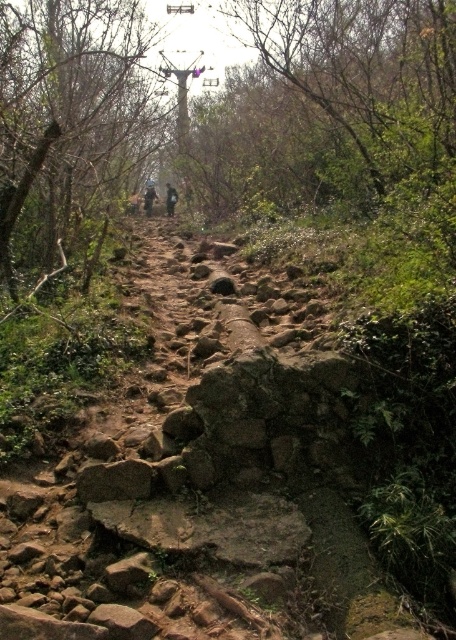
Does point (145, 195) come farther from viewer compared to point (165, 204)?

No, it is not.

Is dark gray fabric jacket at center positioned before dark brown leather backpack at center?

No, it is not.

Measure the distance between point (154, 188) and camera.

The distance of point (154, 188) from camera is 76.91 feet.

Where is `dark gray fabric jacket at center`? dark gray fabric jacket at center is located at coordinates (149, 196).

Who is more forward, (88, 172) or (145, 212)?

Point (88, 172) is in front.

Between brown rough tree at upper left and dark gray fabric jacket at center, which one has less height?

Standing shorter between the two is dark gray fabric jacket at center.

Does point (4, 134) come farther from viewer compared to point (149, 202)?

No.

This screenshot has width=456, height=640. Find the location of `brown rough tree at upper left`. brown rough tree at upper left is located at coordinates (68, 120).

Is brown rough tree at upper left wider than dark brown leather backpack at center?

Correct, the width of brown rough tree at upper left exceeds that of dark brown leather backpack at center.

Does brown rough tree at upper left have a larger size compared to dark brown leather backpack at center?

Yes, brown rough tree at upper left is bigger than dark brown leather backpack at center.

The width and height of the screenshot is (456, 640). I want to click on brown rough tree at upper left, so click(68, 120).